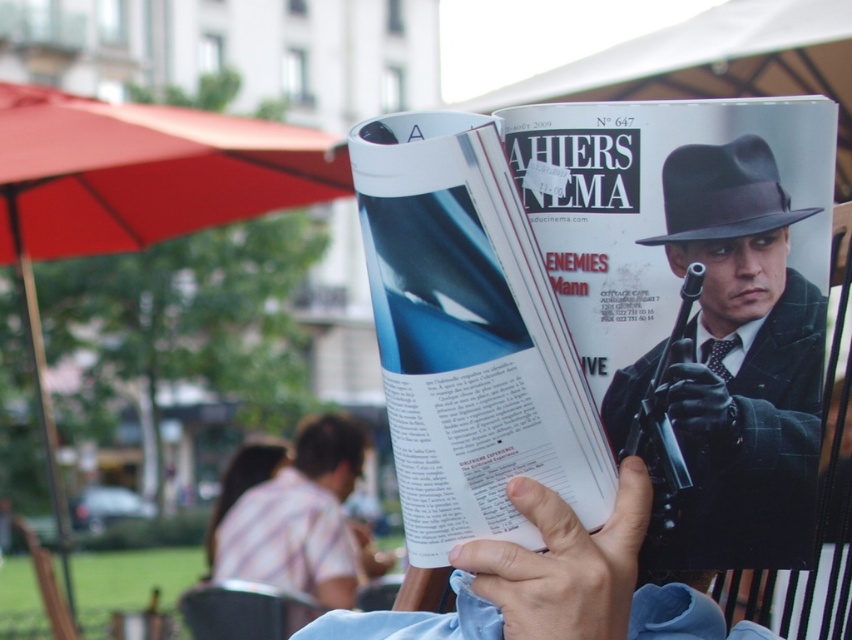
You are a fashion designer observing the scene. You need to determine which item has a larger vertical dimension between the striped shirt at center and the black felt fedora at upper right. Which one is taller?

The striped shirt at center has a greater height compared to the black felt fedora at upper right, so the striped shirt at center is taller.